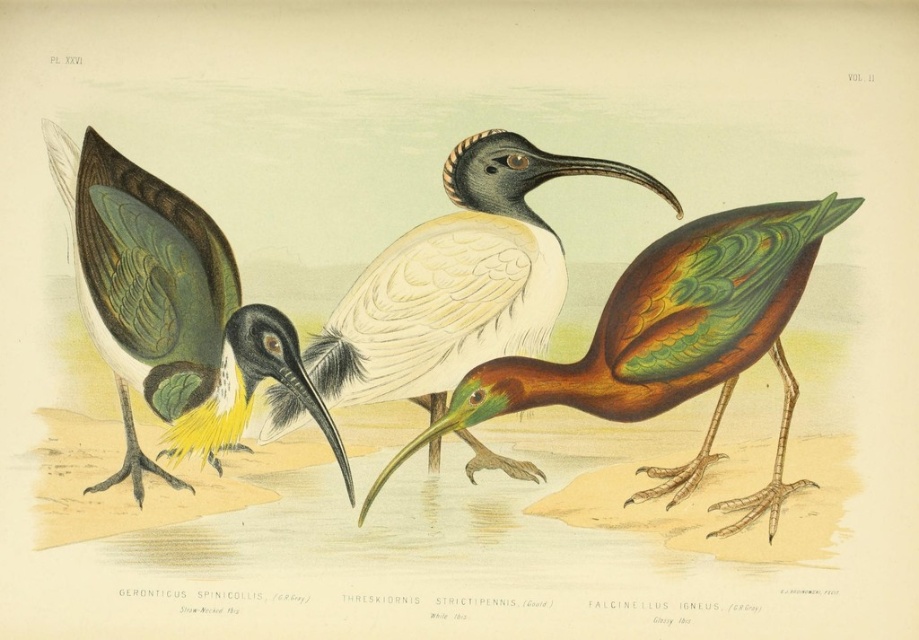
Question: Which object appears closest to the camera in this image?

Choices:
 (A) green glossy feathers at center
 (B) multicolored glossy ibis at center
 (C) white feathered bird at center

Answer: (A)

Question: Is multicolored glossy ibis at center wider than white feathered bird at center?

Choices:
 (A) yes
 (B) no

Answer: (A)

Question: Which point appears closest to the camera in this image?

Choices:
 (A) (747, 244)
 (B) (491, 273)
 (C) (253, 352)

Answer: (A)

Question: Can you confirm if multicolored glossy ibis at center is positioned to the right of green glossy feathers at center?

Choices:
 (A) no
 (B) yes

Answer: (B)

Question: Is multicolored glossy ibis at center below green glossy feathers at center?

Choices:
 (A) yes
 (B) no

Answer: (A)

Question: Which of the following is the closest to the observer?

Choices:
 (A) (434, 396)
 (B) (114, 376)
 (C) (761, 308)

Answer: (C)